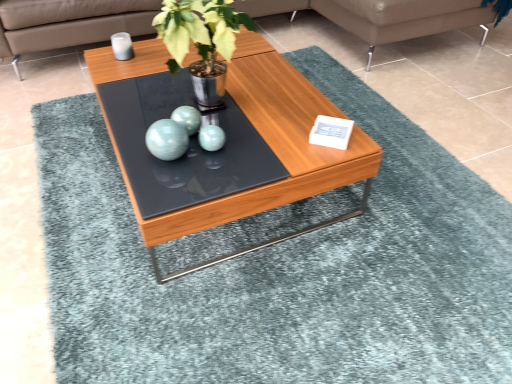
Find the location of a particular element. Image resolution: width=512 pixels, height=384 pixels. space that is in front of wooden coffee table at center is located at coordinates (231, 303).